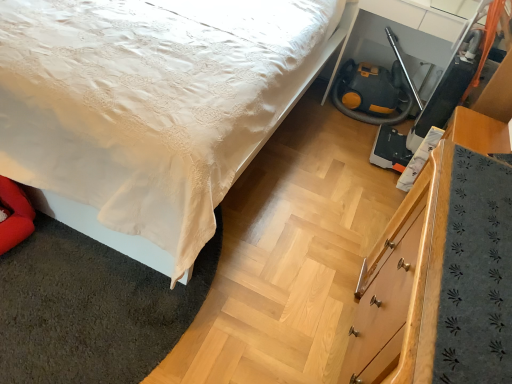
Question: From the image's perspective, would you say wooden chest of drawers at lower right is shown under white satin bedspread at lower left?

Choices:
 (A) yes
 (B) no

Answer: (A)

Question: Considering the relative sizes of wooden chest of drawers at lower right and white satin bedspread at lower left in the image provided, is wooden chest of drawers at lower right shorter than white satin bedspread at lower left?

Choices:
 (A) yes
 (B) no

Answer: (B)

Question: From the image's perspective, is wooden chest of drawers at lower right located above white satin bedspread at lower left?

Choices:
 (A) no
 (B) yes

Answer: (A)

Question: Is wooden chest of drawers at lower right at the right side of white satin bedspread at lower left?

Choices:
 (A) yes
 (B) no

Answer: (A)

Question: Is wooden chest of drawers at lower right outside of white satin bedspread at lower left?

Choices:
 (A) no
 (B) yes

Answer: (B)

Question: Is wooden chest of drawers at lower right taller than white satin bedspread at lower left?

Choices:
 (A) no
 (B) yes

Answer: (B)

Question: Is white satin bed at center in front of wooden chest of drawers at lower right?

Choices:
 (A) yes
 (B) no

Answer: (B)

Question: Does white satin bed at center appear on the right side of wooden chest of drawers at lower right?

Choices:
 (A) yes
 (B) no

Answer: (B)

Question: Can you see white satin bed at center touching wooden chest of drawers at lower right?

Choices:
 (A) yes
 (B) no

Answer: (B)

Question: Is white satin bed at center thinner than wooden chest of drawers at lower right?

Choices:
 (A) yes
 (B) no

Answer: (B)

Question: Does white satin bed at center have a smaller size compared to wooden chest of drawers at lower right?

Choices:
 (A) yes
 (B) no

Answer: (B)

Question: Does white satin bed at center have a lesser height compared to wooden chest of drawers at lower right?

Choices:
 (A) no
 (B) yes

Answer: (A)

Question: Is yellow rubber fire hose at lower right shorter than wooden chest of drawers at lower right?

Choices:
 (A) yes
 (B) no

Answer: (A)